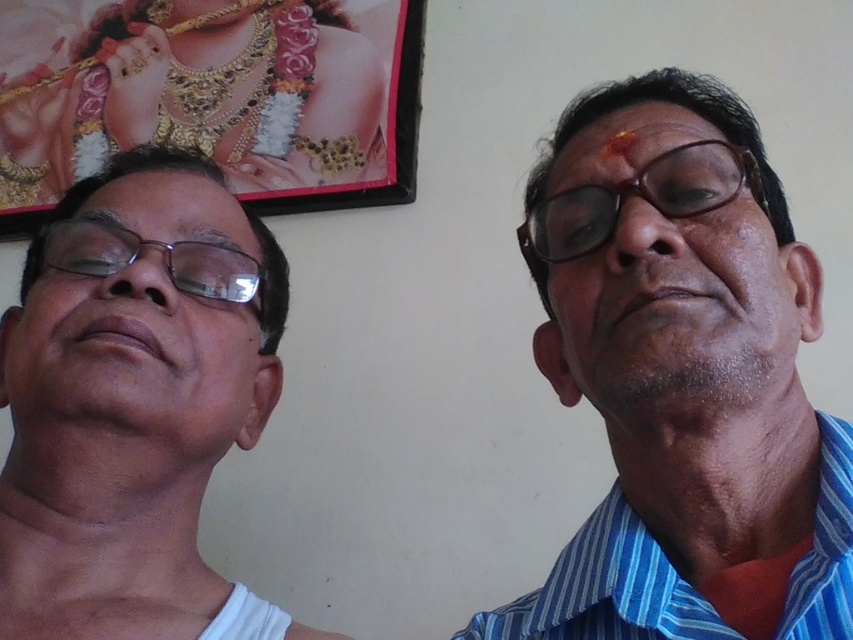
You are an interior designer assessing the placement of objects in the scene. The white fabric at left and the matte black glasses at right are both on a shelf. Which object is closer to the left edge of the shelf?

The white fabric at left is positioned on the left side of matte black glasses at right, so it is closer to the left edge of the shelf.

You are a photographer adjusting your camera settings. You notice the wooden frame at upper left and the matte plastic glasses at left in your viewfinder. Which object is closer to the camera lens?

The matte plastic glasses at left is behind the wooden frame at upper left, so the wooden frame at upper left is closer to the camera lens.